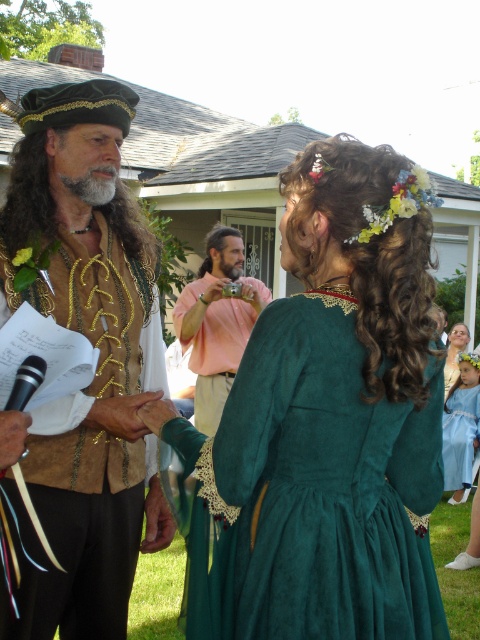
You are an event planner organizing a Renaissance fair and need to ensure that the performers are easily visible to the audience. Based on the image, which of the two features at the center, the curly brown hair at center or the grayhairbeard at center, would be more noticeable to the audience due to its size?

The curly brown hair at center is larger in size than the grayhairbeard at center, so it would be more noticeable to the audience.

You are a costume designer preparing for a Renaissance fair. You need to ensure that the green velvet dress at center and the curly brown hair at center are arranged in a way that the dress does not overshadow the hair. Based on the scene description, which object should be positioned closer to the audience to maintain visual balance?

The curly brown hair at center should be positioned closer to the audience because the green velvet dress at center might be wider than the curly brown hair at center, making it visually dominant. By placing the hair slightly forward, it can balance the composition without being overshadowed.

What is located at the coordinates point (326, 424)?

The green velvet dress at center is located at point (326, 424).